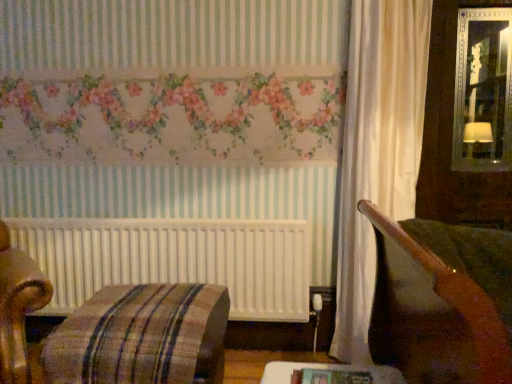
Question: From the image's perspective, does plaid fabric ottoman at lower left appear higher than wooden table at lower center?

Choices:
 (A) no
 (B) yes

Answer: (A)

Question: Is the position of plaid fabric ottoman at lower left less distant than that of wooden table at lower center?

Choices:
 (A) yes
 (B) no

Answer: (B)

Question: Considering the relative sizes of plaid fabric ottoman at lower left and wooden table at lower center in the image provided, is plaid fabric ottoman at lower left smaller than wooden table at lower center?

Choices:
 (A) yes
 (B) no

Answer: (B)

Question: Is plaid fabric ottoman at lower left wider than wooden table at lower center?

Choices:
 (A) no
 (B) yes

Answer: (B)

Question: Is plaid fabric ottoman at lower left bigger than wooden table at lower center?

Choices:
 (A) yes
 (B) no

Answer: (A)

Question: Does plaid fabric ottoman at lower left have a greater height compared to wooden table at lower center?

Choices:
 (A) yes
 (B) no

Answer: (A)

Question: Is wooden table at lower center closer to camera compared to plaid fabric ottoman at lower left?

Choices:
 (A) yes
 (B) no

Answer: (A)

Question: Is wooden table at lower center far away from plaid fabric ottoman at lower left?

Choices:
 (A) yes
 (B) no

Answer: (B)

Question: Is wooden table at lower center directly adjacent to plaid fabric ottoman at lower left?

Choices:
 (A) no
 (B) yes

Answer: (A)

Question: Can you confirm if wooden table at lower center is wider than plaid fabric ottoman at lower left?

Choices:
 (A) no
 (B) yes

Answer: (A)

Question: Is wooden table at lower center outside plaid fabric ottoman at lower left?

Choices:
 (A) no
 (B) yes

Answer: (B)

Question: Is wooden table at lower center looking in the opposite direction of plaid fabric ottoman at lower left?

Choices:
 (A) no
 (B) yes

Answer: (A)

Question: From the image's perspective, is wooden table at lower center located above or below plaid fabric ottoman at lower left?

Choices:
 (A) below
 (B) above

Answer: (B)